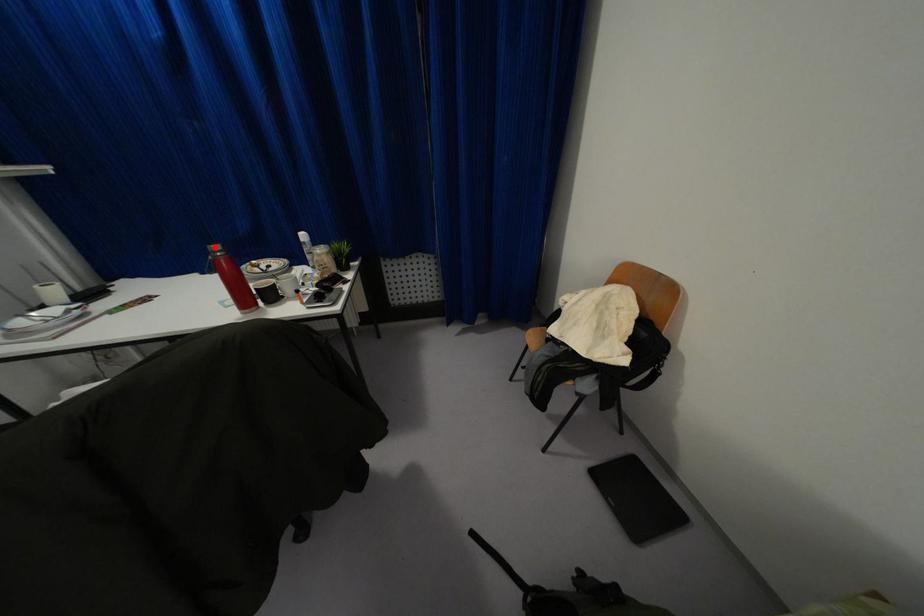
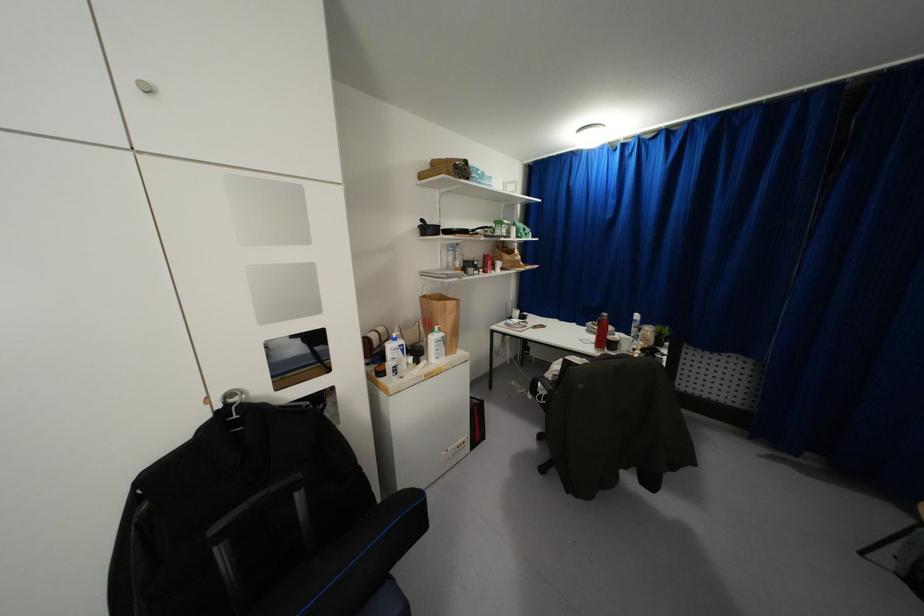
Locate, in the second image, the point that corresponds to the highlighted location in the first image.

(603, 314)